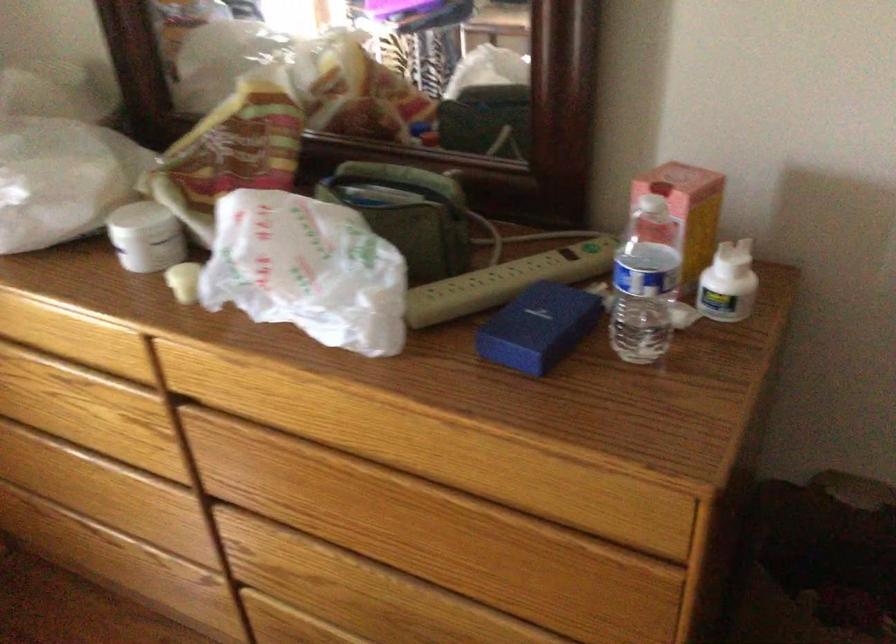
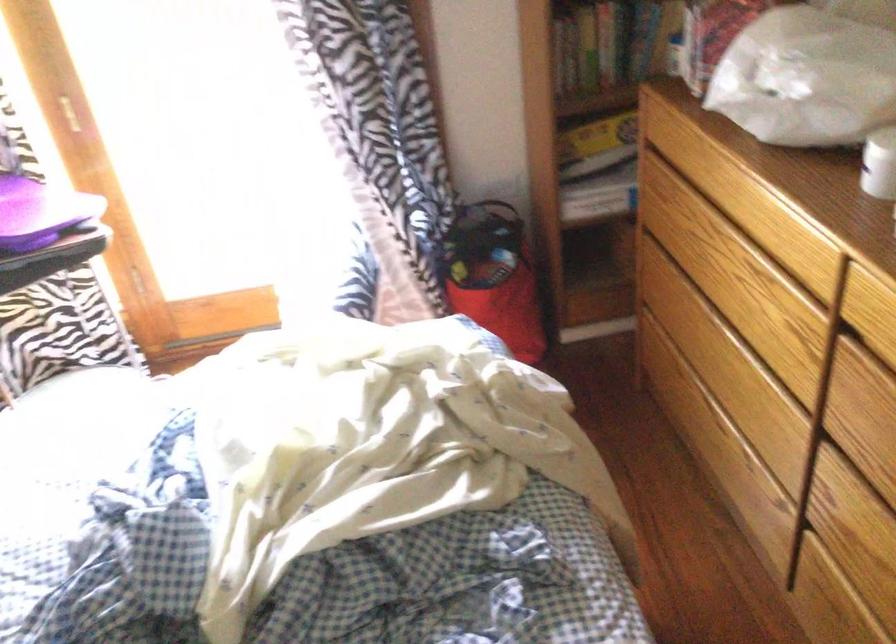
In the second image, find the point that corresponds to (209,400) in the first image.

(874, 339)